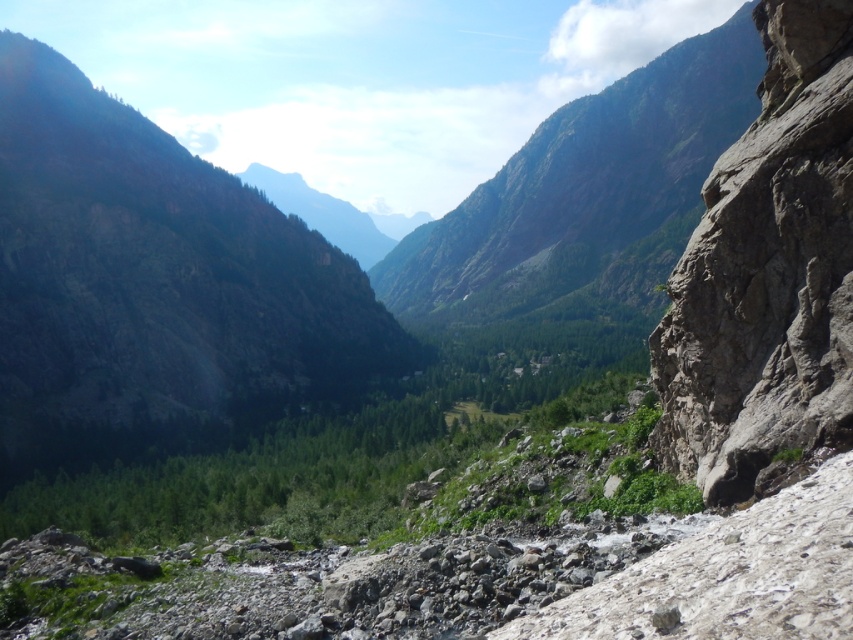
You are a hiker planning to climb both the green rocky mountain at upper left and the green rock mountain at center. Based on their sizes, which mountain should you attempt first if you want to start with the easier climb?

The green rocky mountain at upper left is smaller than the green rock mountain at center, so it would be easier to climb first.

You are a hiker planning to take a photo of the mountains in the background. You want to capture both the green rocky mountain at upper left and the green rock mountain at center in your shot. Based on their positions, which mountain is closer to the camera?

The green rocky mountain at upper left is positioned under the green rock mountain at center, meaning it is closer to the camera.

You are a hiker standing at the base of the mountain. You want to reach the summit of the green rocky mountain at upper left. If your average hiking speed is 2 miles per hour, how many hours will it take you to reach the summit?

The distance of green rocky mountain at upper left from viewer is 310.17 feet. Converting this to miles, 310.17 feet is approximately 0.06 miles. At a speed of 2 miles per hour, it would take roughly 0.03 hours, which is about 1.8 minutes to reach the summit.